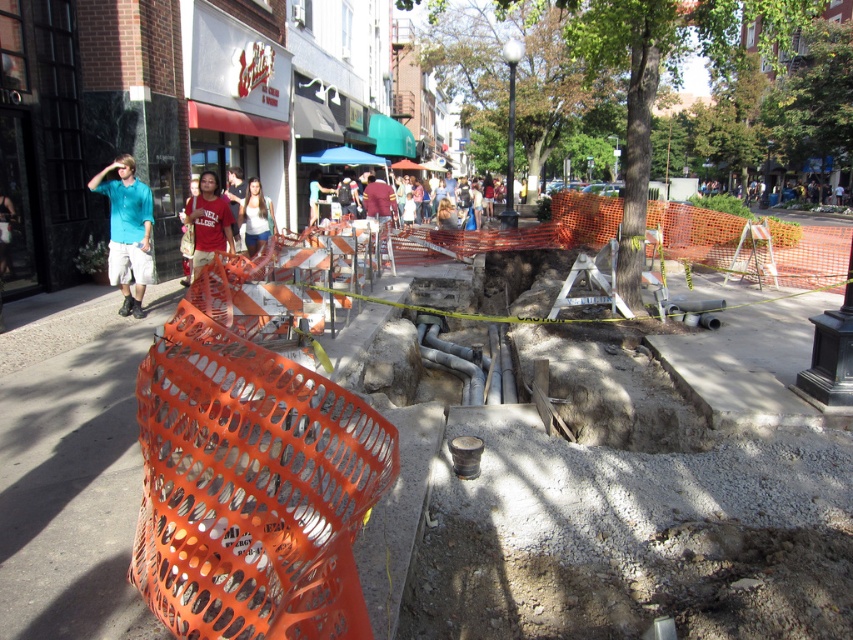
Question: In this image, where is teal shirt at left located relative to matte white shirt at center?

Choices:
 (A) above
 (B) below

Answer: (B)

Question: Which point is closer to the camera taking this photo?

Choices:
 (A) (247, 182)
 (B) (117, 208)

Answer: (B)

Question: Which of the following is the closest to the observer?

Choices:
 (A) orange plastic barrier at center
 (B) matte red t-shirt at center

Answer: (A)

Question: Which point is closer to the camera?

Choices:
 (A) orange plastic barrier at center
 (B) matte white shirt at center
 (C) orange mesh barrier at center
 (D) matte red t-shirt at center

Answer: (A)

Question: Can you confirm if matte red t-shirt at center is positioned above matte white shirt at center?

Choices:
 (A) no
 (B) yes

Answer: (A)

Question: Considering the relative positions of orange plastic barrier at center and matte white shirt at center in the image provided, where is orange plastic barrier at center located with respect to matte white shirt at center?

Choices:
 (A) right
 (B) left

Answer: (A)